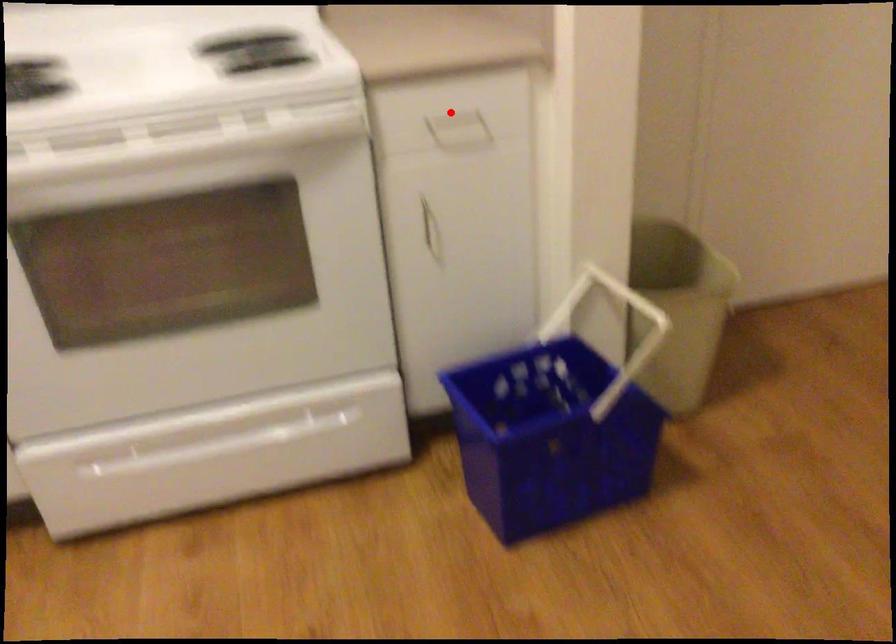
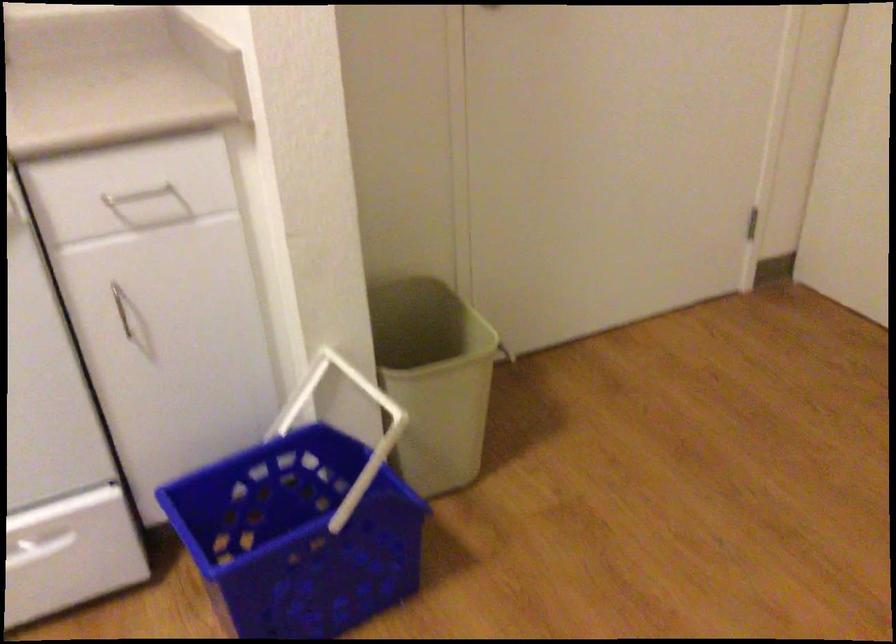
Question: I am providing you with two images of the same scene from different viewpoints. Given a red point in image1, look at the same physical point in image2. Is it:

Choices:
 (A) Closer to the viewpoint
 (B) Farther from the viewpoint

Answer: (A)